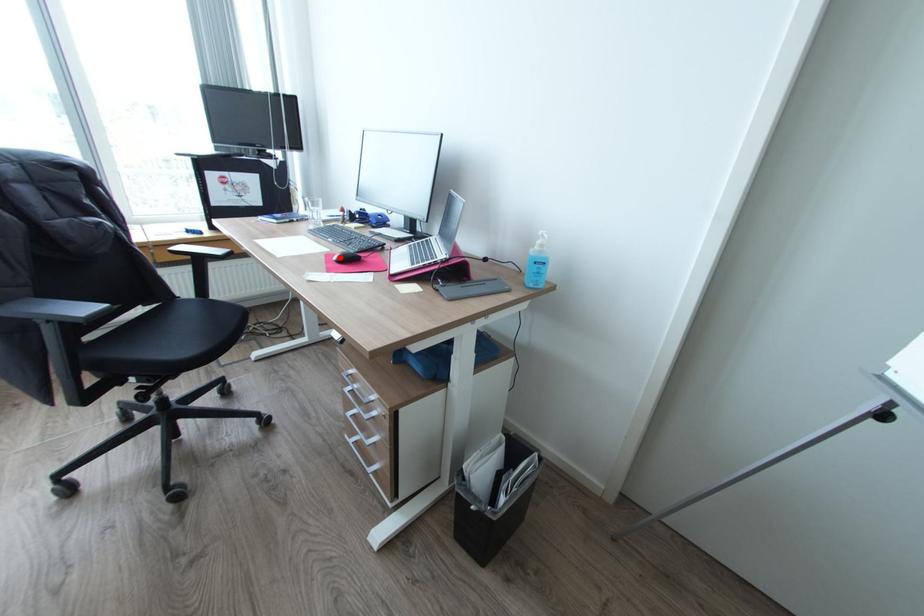
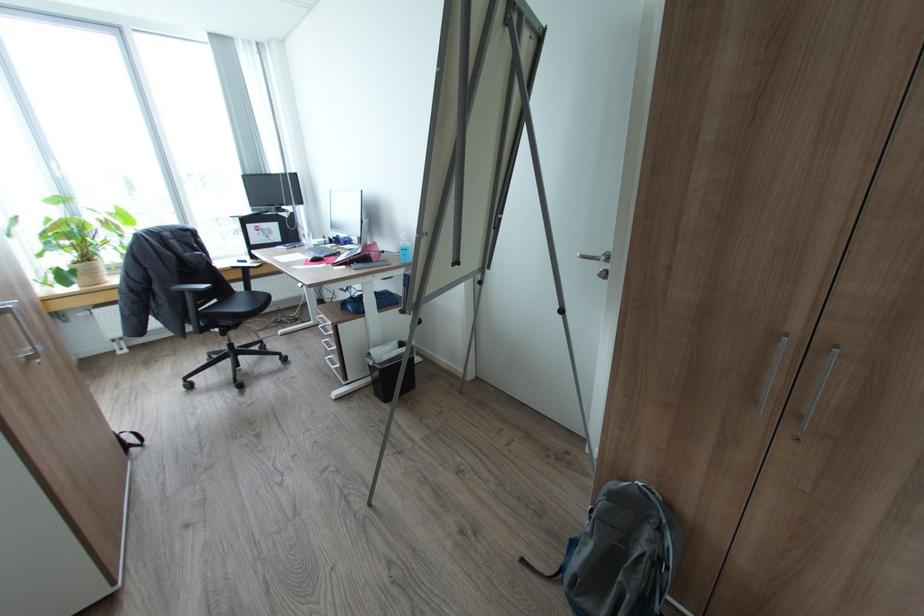
In the second image, find the point that corresponds to the highlighted location in the first image.

(314, 259)